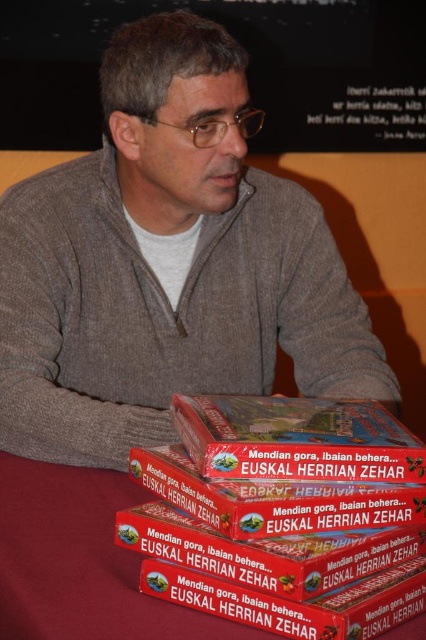
Between brown cardboard boxes at lower center and matte cardboard box at center, which one appears on the left side from the viewer's perspective?

brown cardboard boxes at lower center

Which is more to the right, brown cardboard boxes at lower center or matte cardboard box at center?

matte cardboard box at center is more to the right.

The width and height of the screenshot is (426, 640). What do you see at coordinates (80, 561) in the screenshot? I see `brown cardboard boxes at lower center` at bounding box center [80, 561].

Locate an element on the screen. This screenshot has height=640, width=426. brown cardboard boxes at lower center is located at coordinates point(80,561).

Is matte cardboard box at center smaller than red cardboard box at center?

Actually, matte cardboard box at center might be larger than red cardboard box at center.

Can you confirm if matte cardboard box at center is positioned below red cardboard box at center?

No.

Who is more forward, (342, 452) or (210, 492)?

Point (210, 492)

You are a GUI agent. You are given a task and a screenshot of the screen. Output one action in this format:
    pyautogui.click(x=<x>, y=<y>)
    Task: Click on the matte cardboard box at center
    
    Given the screenshot: What is the action you would take?
    pyautogui.click(x=296, y=438)

Between brown cardboard boxes at lower center and matte cardboard box at lower center, which one appears on the right side from the viewer's perspective?

matte cardboard box at lower center is more to the right.

At what (x,y) coordinates should I click in order to perform the action: click on brown cardboard boxes at lower center. Please return your answer as a coordinate pair (x, y). This screenshot has width=426, height=640. Looking at the image, I should click on (80, 561).

Is point (103, 596) farther from camera compared to point (152, 563)?

Yes, point (103, 596) is farther from viewer.

The width and height of the screenshot is (426, 640). Identify the location of brown cardboard boxes at lower center. (80, 561).